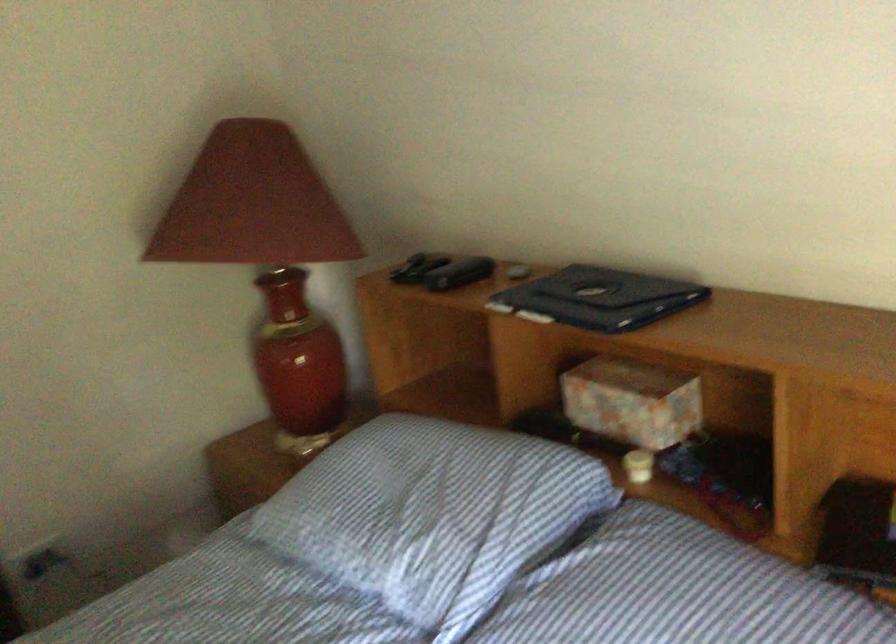
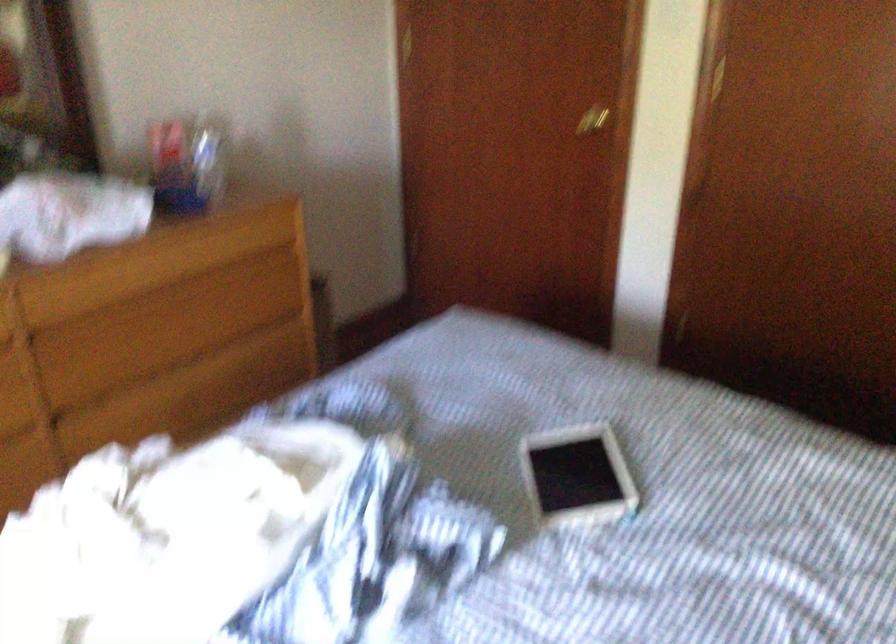
The first image is from the beginning of the video and the second image is from the end. How did the camera likely rotate when shooting the video?

The rotation direction of the camera is left-down.